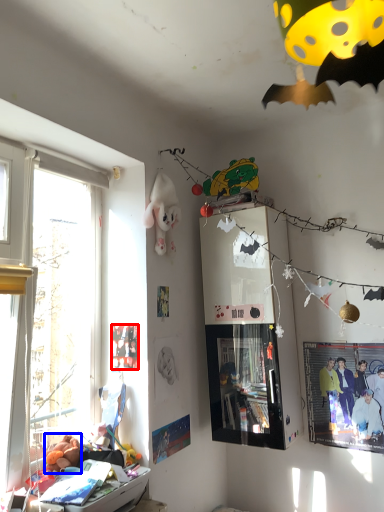
Question: Which point is further to the camera, poster page (highlighted by a red box) or toy (highlighted by a blue box)?

Choices:
 (A) poster page
 (B) toy

Answer: (A)